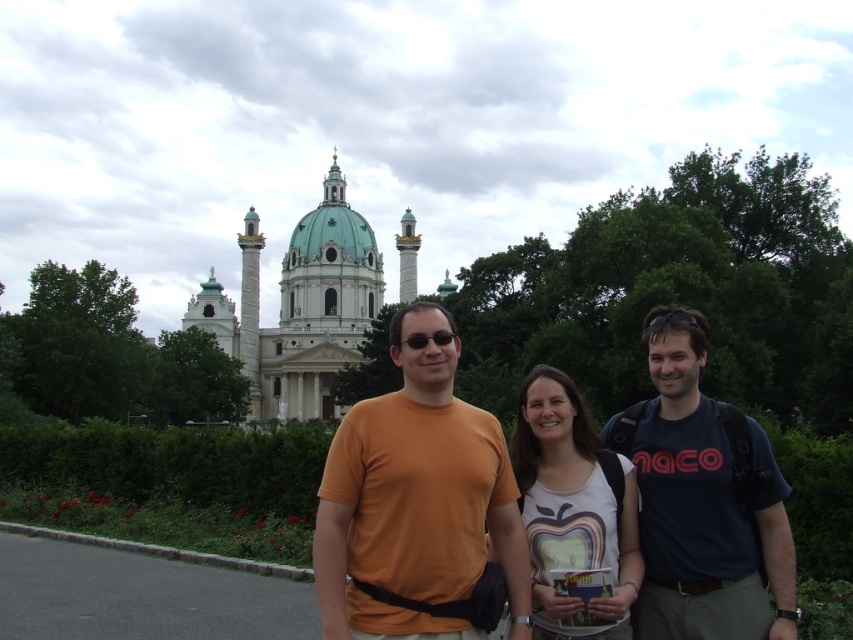
The image size is (853, 640). What do you see at coordinates (544, 506) in the screenshot?
I see `orange cotton shirt at center` at bounding box center [544, 506].

Does orange cotton shirt at center appear on the left side of orange t-shirt at center?

No, orange cotton shirt at center is not to the left of orange t-shirt at center.

The height and width of the screenshot is (640, 853). What do you see at coordinates (544, 506) in the screenshot?
I see `orange cotton shirt at center` at bounding box center [544, 506].

Where is `orange cotton shirt at center`? The image size is (853, 640). orange cotton shirt at center is located at coordinates (544, 506).

Is white marble palace at upper center bigger than white matte t-shirt at center?

Yes.

Between white marble palace at upper center and white matte t-shirt at center, which one is positioned higher?

Positioned higher is white marble palace at upper center.

Between point (334, 157) and point (599, 509), which one is positioned behind?

Positioned behind is point (334, 157).

Where is `white marble palace at upper center`? white marble palace at upper center is located at coordinates (299, 307).

Where is `orange cotton shirt at center`? orange cotton shirt at center is located at coordinates (544, 506).

Is point (691, 474) in front of point (416, 344)?

No, (691, 474) is further to viewer.

Where is `orange cotton shirt at center`? This screenshot has height=640, width=853. orange cotton shirt at center is located at coordinates (544, 506).